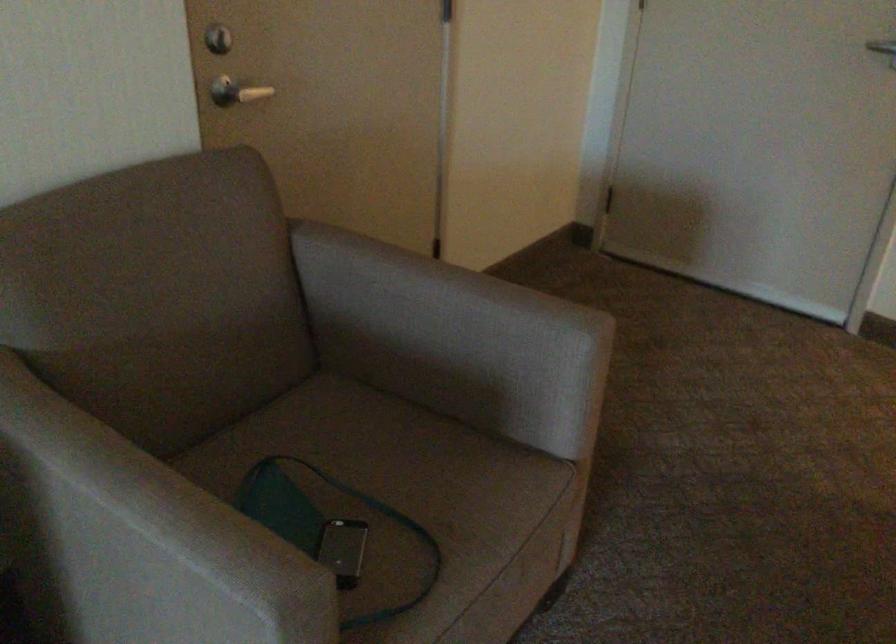
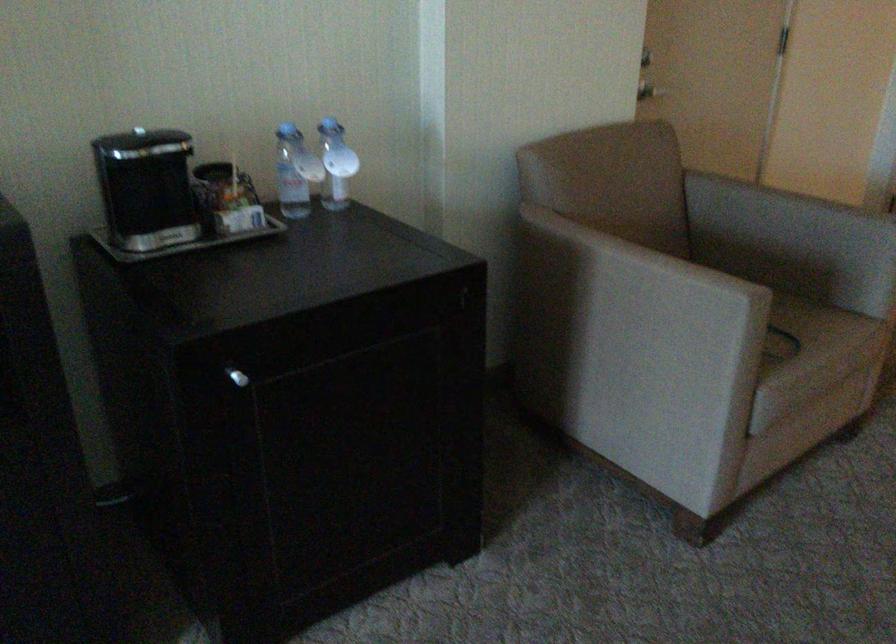
The point at (229, 114) is marked in the first image. Where is the corresponding point in the second image?

(649, 90)